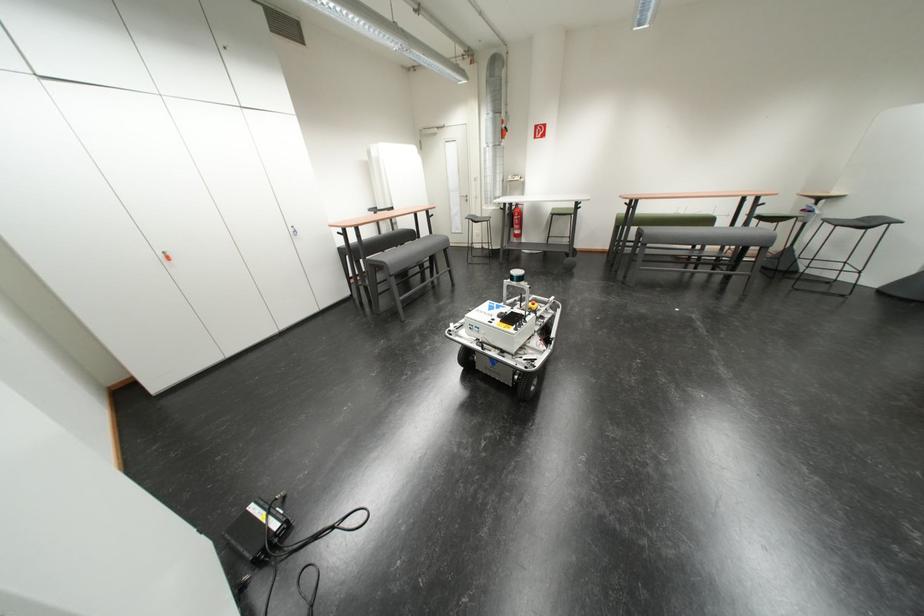
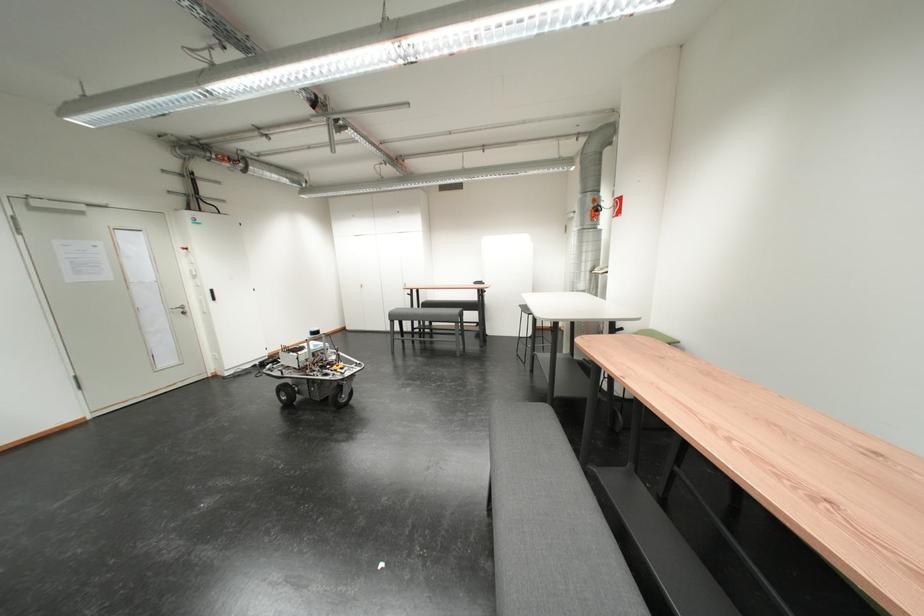
Question: I am providing you with two images of the same scene from different viewpoints. After the viewpoint changes to image2, which objects are now occluded?

Choices:
 (A) white cabinet handle
 (B) fire extinguisher handle
 (C) white mesh curtain
 (D) silver door handle

Answer: (B)